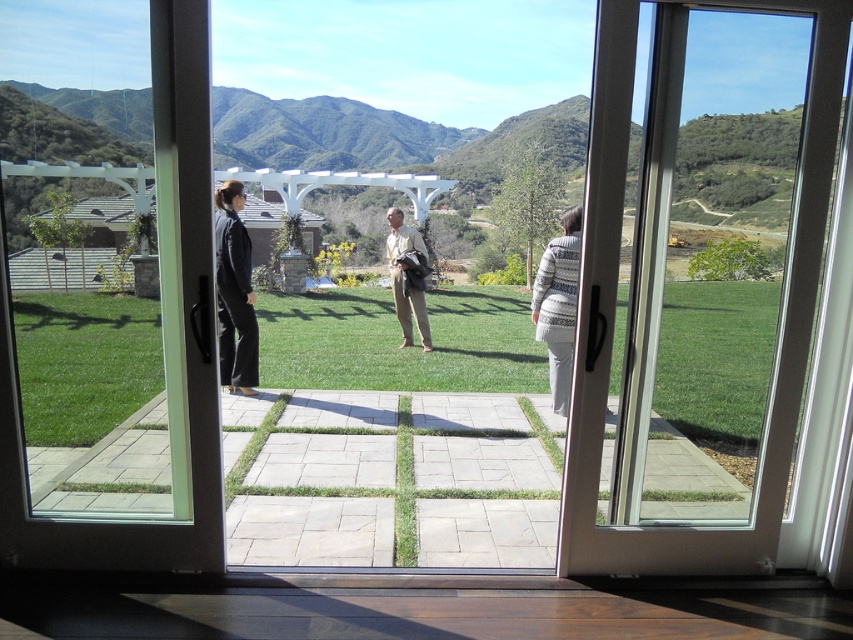
Question: Which object is the farthest from the clear glass door at center?

Choices:
 (A) white glossy door at right
 (B) light beige cotton pants at center
 (C) gray knitted sweater at right

Answer: (B)

Question: Which of the following is the closest to the observer?

Choices:
 (A) clear glass door at center
 (B) light beige cotton pants at center
 (C) gray knitted sweater at right

Answer: (A)

Question: Is white glossy door at right positioned in front of gray knitted sweater at right?

Choices:
 (A) yes
 (B) no

Answer: (A)

Question: Does clear glass door at center appear under black leather pants at left?

Choices:
 (A) no
 (B) yes

Answer: (B)

Question: Is black leather pants at left below gray knitted sweater at right?

Choices:
 (A) no
 (B) yes

Answer: (A)

Question: Which point is farther from the camera taking this photo?

Choices:
 (A) (416, 314)
 (B) (798, 353)
 (C) (41, 538)
 (D) (216, 227)

Answer: (A)